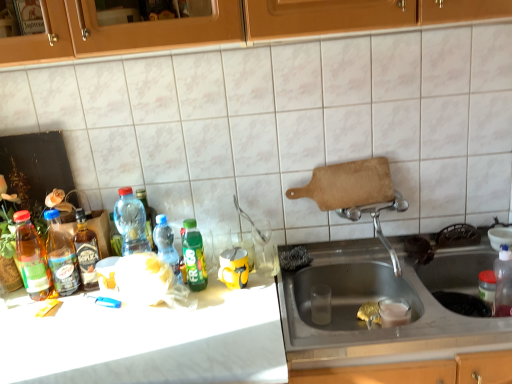
Question: Are translucent plastic bottle at center, which is counted as the 5th bottle, starting from the left, and white marble countertop at center far apart?

Choices:
 (A) yes
 (B) no

Answer: (B)

Question: From a real-world perspective, is translucent plastic bottle at center, which is counted as the 5th bottle, starting from the left, beneath white marble countertop at center?

Choices:
 (A) yes
 (B) no

Answer: (B)

Question: Considering the relative positions of translucent plastic bottle at center, positioned as the 3th bottle in right-to-left order, and white marble countertop at center in the image provided, is translucent plastic bottle at center, positioned as the 3th bottle in right-to-left order, behind white marble countertop at center?

Choices:
 (A) yes
 (B) no

Answer: (A)

Question: Is white marble countertop at center completely or partially inside translucent plastic bottle at center, positioned as the 3th bottle in right-to-left order?

Choices:
 (A) yes
 (B) no

Answer: (B)

Question: Is translucent plastic bottle at center, positioned as the 3th bottle in right-to-left order, to the left of white marble countertop at center from the viewer's perspective?

Choices:
 (A) yes
 (B) no

Answer: (A)

Question: From a real-world perspective, is translucent plastic bottle at center, positioned as the 3th bottle in right-to-left order, on top of white marble countertop at center?

Choices:
 (A) yes
 (B) no

Answer: (A)

Question: Considering the relative sizes of translucent plastic bottle at center, positioned as the 3th bottle in right-to-left order, and stainless steel sink at lower right in the image provided, is translucent plastic bottle at center, positioned as the 3th bottle in right-to-left order, wider than stainless steel sink at lower right?

Choices:
 (A) yes
 (B) no

Answer: (B)

Question: Does translucent plastic bottle at center, which is counted as the 5th bottle, starting from the left, come behind stainless steel sink at lower right?

Choices:
 (A) yes
 (B) no

Answer: (A)

Question: Is translucent plastic bottle at center, which is counted as the 5th bottle, starting from the left, not within stainless steel sink at lower right?

Choices:
 (A) yes
 (B) no

Answer: (A)

Question: Can you confirm if translucent plastic bottle at center, which is counted as the 5th bottle, starting from the left, is bigger than stainless steel sink at lower right?

Choices:
 (A) no
 (B) yes

Answer: (A)

Question: Is translucent plastic bottle at center, positioned as the 3th bottle in right-to-left order, next to stainless steel sink at lower right?

Choices:
 (A) no
 (B) yes

Answer: (A)

Question: From the image's perspective, is translucent plastic bottle at center, positioned as the 3th bottle in right-to-left order, beneath stainless steel sink at lower right?

Choices:
 (A) yes
 (B) no

Answer: (B)

Question: Does stainless steel sink at lower right appear on the left side of translucent plastic bottle at center, which is counted as the 5th bottle, starting from the left?

Choices:
 (A) yes
 (B) no

Answer: (B)